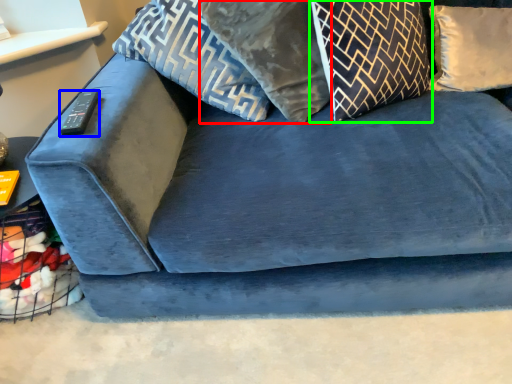
Question: Estimate the real-world distances between objects in this image. Which object is farther from pillow (highlighted by a red box), remote (highlighted by a blue box) or pillow (highlighted by a green box)?

Choices:
 (A) remote
 (B) pillow

Answer: (A)